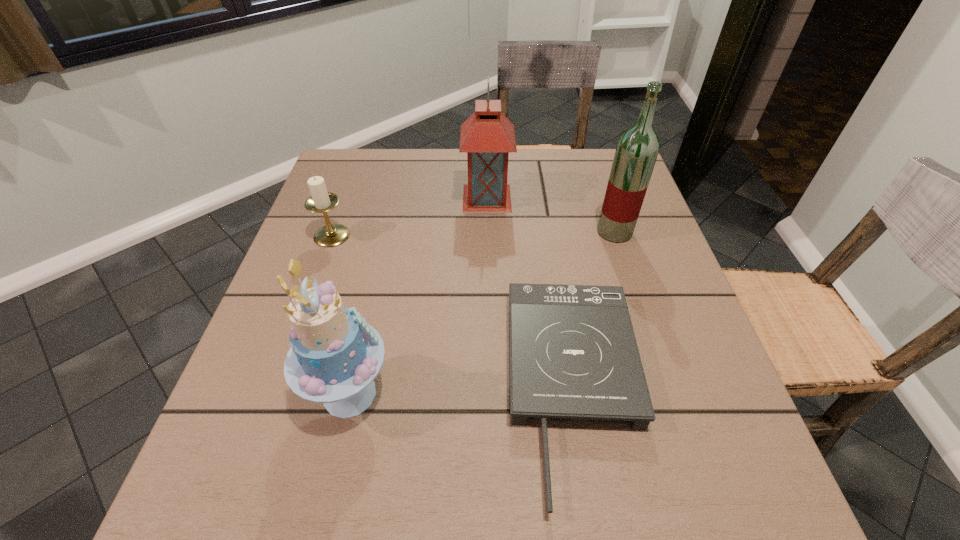
Locate an element on the screen. This screenshot has width=960, height=540. free space between the liquor and the fourth object from right to left is located at coordinates (482, 313).

The width and height of the screenshot is (960, 540). Identify the location of object that is the fourth closest to the shortest object. (320, 201).

What are the coordinates of `object that is the fourth closest to the liquor` in the screenshot? It's located at (320, 201).

This screenshot has height=540, width=960. Find the location of `free space that satisfies the following two spatial constraints: 1. on the back side of the liquor; 2. on the right side of the hotplate`. free space that satisfies the following two spatial constraints: 1. on the back side of the liquor; 2. on the right side of the hotplate is located at coordinates (549, 232).

This screenshot has width=960, height=540. Find the location of `vacant space that satisfies the following two spatial constraints: 1. on the back side of the liquor; 2. on the right side of the candle holder`. vacant space that satisfies the following two spatial constraints: 1. on the back side of the liquor; 2. on the right side of the candle holder is located at coordinates (333, 232).

This screenshot has width=960, height=540. Identify the location of free space that satisfies the following two spatial constraints: 1. on the back side of the shortest object; 2. on the right side of the liquor. (549, 232).

What are the coordinates of `free spot that satisfies the following two spatial constraints: 1. on the front side of the hotplate; 2. on the right side of the candle holder` in the screenshot? It's located at (277, 388).